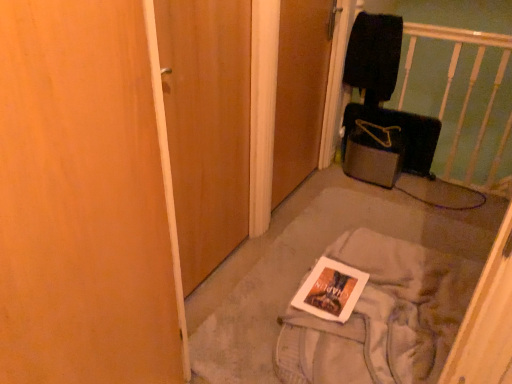
I want to click on free space between black fabric infant bed at upper right and white fabric book at center, so click(409, 202).